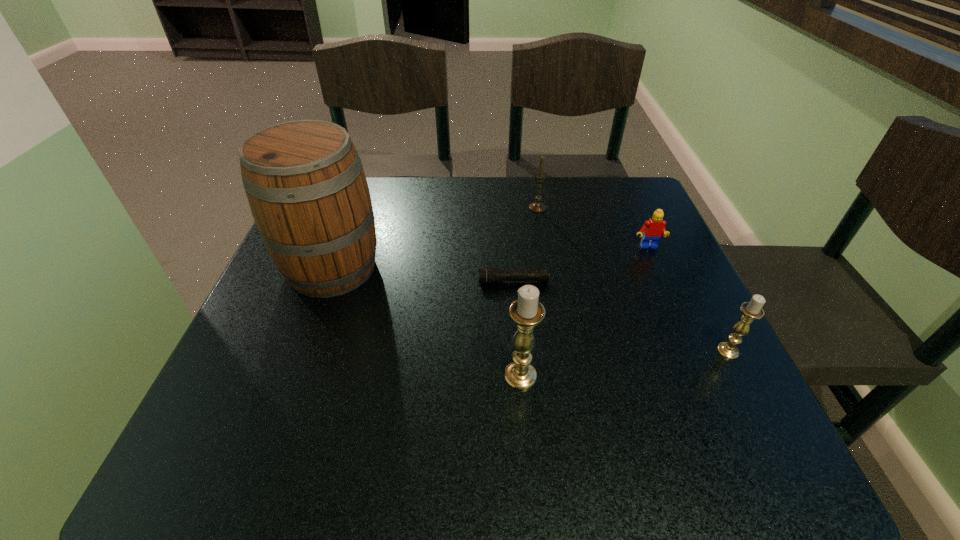
The height and width of the screenshot is (540, 960). I want to click on vacant space located 0.080m on the left of the taller candle holder, so click(x=458, y=376).

The height and width of the screenshot is (540, 960). Identify the location of blank space located on the back of the farther candle holder. (671, 239).

Identify the location of vacant area situated on the right of the cider. (537, 268).

What are the coordinates of `free location located on the front of the farthest object` in the screenshot? It's located at pos(545,253).

Locate an element on the screen. This screenshot has width=960, height=540. vacant region located on the front-facing side of the Lego is located at coordinates (x=692, y=350).

Locate an element on the screen. The image size is (960, 540). vacant space located at the lens end of the flashlight is located at coordinates (290, 281).

This screenshot has height=540, width=960. Identify the location of vacant space located 0.180m at the lens end of the flashlight. (394, 281).

Locate an element on the screen. vacant area located 0.150m at the lens end of the flashlight is located at coordinates (408, 281).

Where is `object present at the far edge`? The width and height of the screenshot is (960, 540). object present at the far edge is located at coordinates (537, 206).

This screenshot has height=540, width=960. What are the coordinates of `object present at the near edge` in the screenshot? It's located at (526, 312).